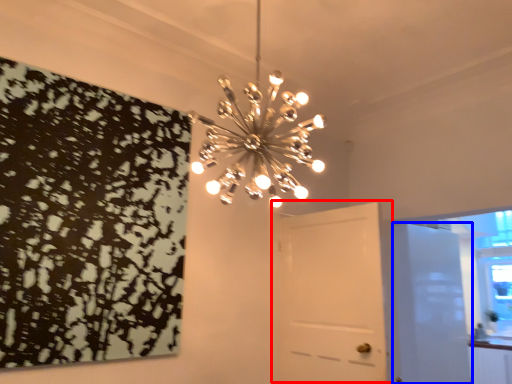
Question: Which point is closer to the camera, door (highlighted by a red box) or door (highlighted by a blue box)?

Choices:
 (A) door
 (B) door

Answer: (A)